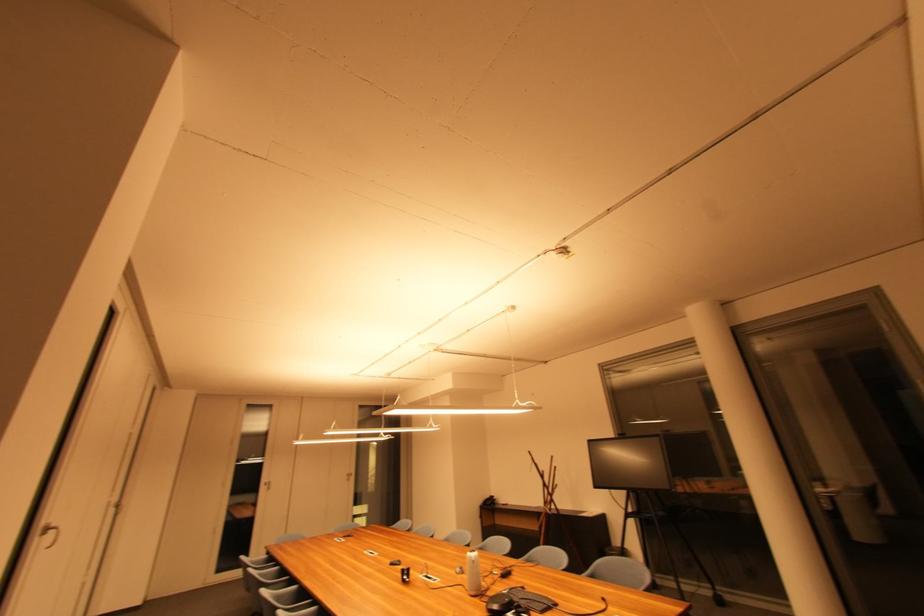
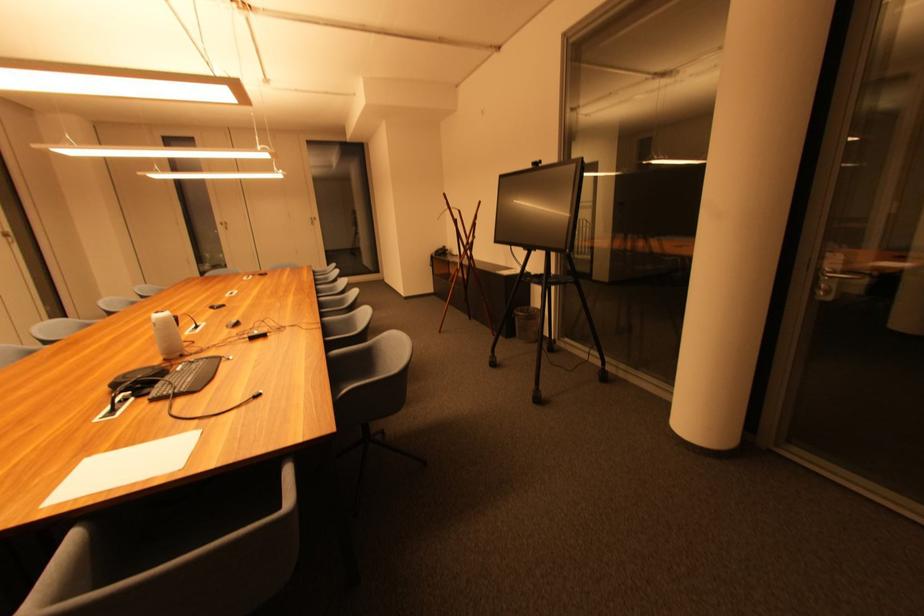
Locate, in the second image, the point that corresponds to pixel 271 485 in the first image.

(226, 225)